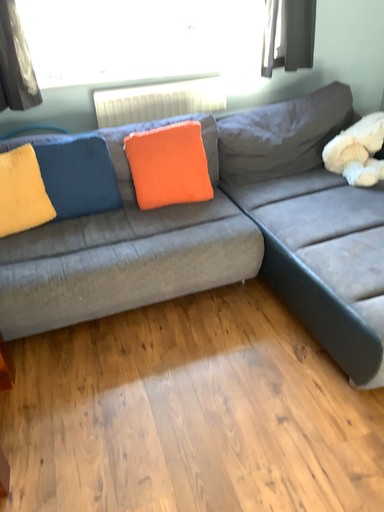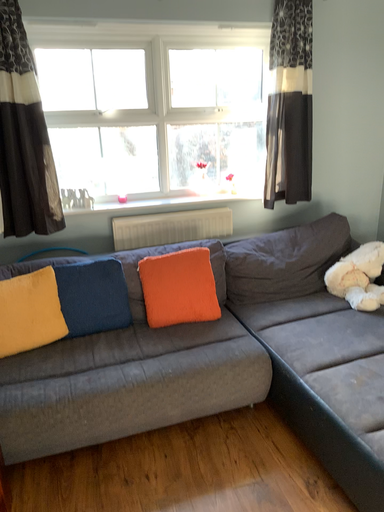
Question: How did the camera likely rotate when shooting the video?

Choices:
 (A) rotated upward
 (B) rotated downward

Answer: (A)